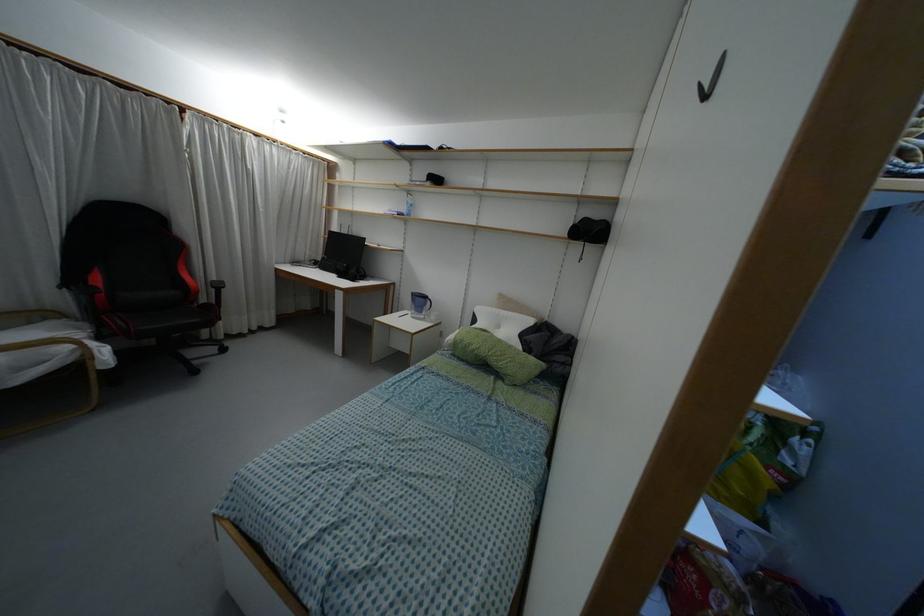
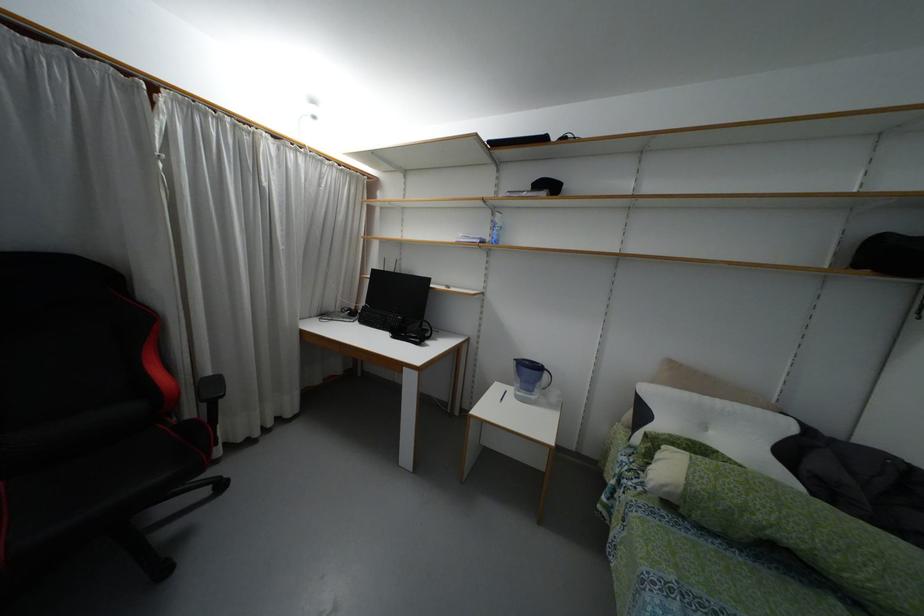
Locate, in the second image, the point that corresponds to [217,286] in the first image.

(213, 387)